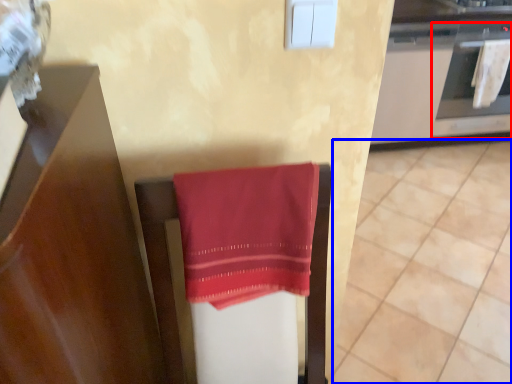
Question: Which object appears farthest to the camera in this image, oven (highlighted by a red box) or tile (highlighted by a blue box)?

Choices:
 (A) oven
 (B) tile

Answer: (A)